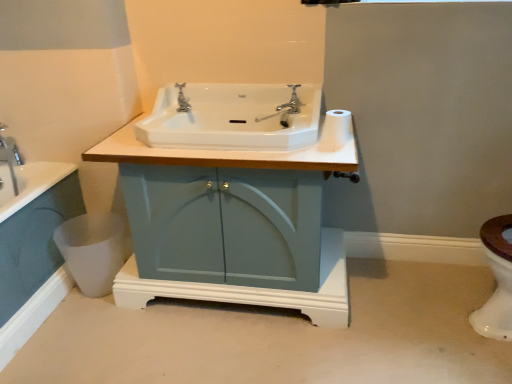
The height and width of the screenshot is (384, 512). Find the location of `free space that is in between silver metallic faucet at center and chrome metallic faucet at upper center`. free space that is in between silver metallic faucet at center and chrome metallic faucet at upper center is located at coordinates (243, 115).